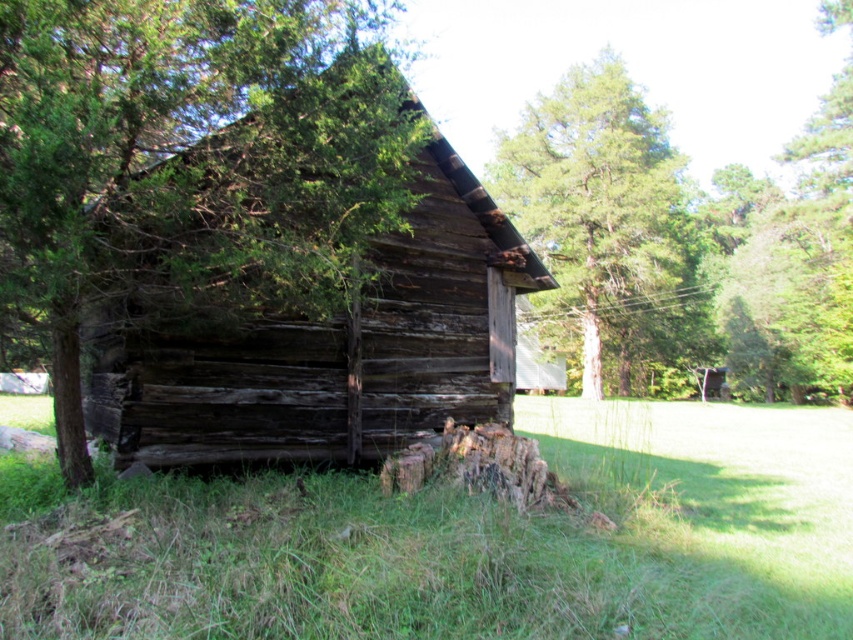
Question: Which of the following is the closest to the observer?

Choices:
 (A) (223, 596)
 (B) (90, 90)

Answer: (A)

Question: Can you confirm if green grass at lower left is smaller than green rough bark tree at upper center?

Choices:
 (A) yes
 (B) no

Answer: (A)

Question: Is green grass at lower left positioned behind green leafy tree at center?

Choices:
 (A) no
 (B) yes

Answer: (B)

Question: Which object appears closest to the camera in this image?

Choices:
 (A) green grass at lower left
 (B) green rough bark tree at upper center

Answer: (A)

Question: Observing the image, what is the correct spatial positioning of green grass at lower left in reference to green rough bark tree at upper center?

Choices:
 (A) left
 (B) right

Answer: (A)

Question: Which object is closer to the camera taking this photo?

Choices:
 (A) green rough bark tree at upper center
 (B) green leafy tree at center

Answer: (B)